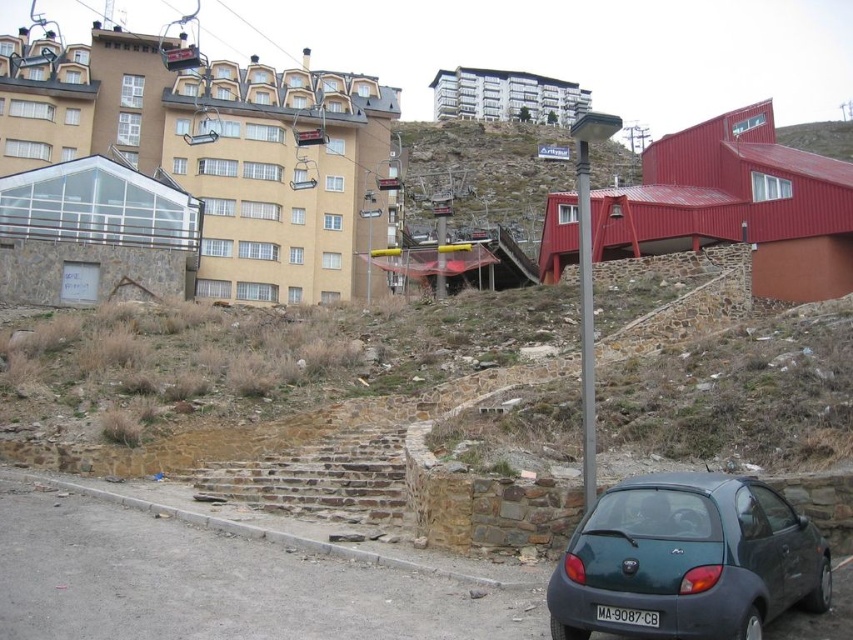
Question: Which point is closer to the camera taking this photo?

Choices:
 (A) (665, 540)
 (B) (585, 348)
 (C) (399, 442)

Answer: (A)

Question: Does metallic gray hatchback at lower right have a smaller size compared to black plastic license plate at lower center?

Choices:
 (A) yes
 (B) no

Answer: (B)

Question: Does brown stone stairs at center have a larger size compared to black plastic license plate at lower center?

Choices:
 (A) no
 (B) yes

Answer: (B)

Question: Is metallic gray hatchback at lower right wider than metallic pole at center?

Choices:
 (A) yes
 (B) no

Answer: (B)

Question: Estimate the real-world distances between objects in this image. Which object is farther from the metallic pole at center?

Choices:
 (A) black plastic license plate at lower center
 (B) brown stone stairs at center

Answer: (B)

Question: Which of the following is the closest to the observer?

Choices:
 (A) metallic gray hatchback at lower right
 (B) brown stone stairs at center

Answer: (A)